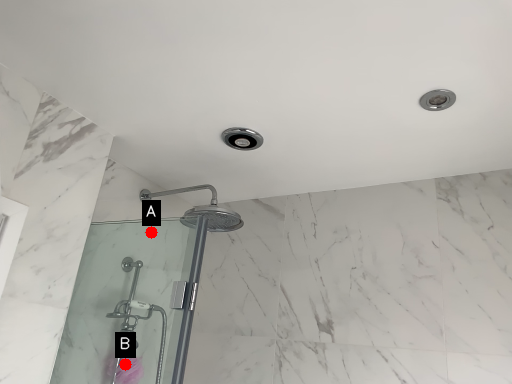
Question: Two points are circled on the image, labeled by A and B beside each circle. Which point is farther from the camera taking this photo?

Choices:
 (A) A is further
 (B) B is further

Answer: (A)